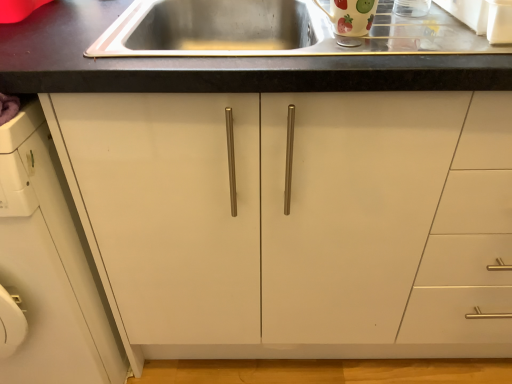
Question: Is glossy ceramic mug at upper center next to white matte cabinet at left?

Choices:
 (A) no
 (B) yes

Answer: (A)

Question: Is glossy ceramic mug at upper center positioned before white matte cabinet at left?

Choices:
 (A) yes
 (B) no

Answer: (B)

Question: Considering the relative positions of glossy ceramic mug at upper center and white matte cabinet at left in the image provided, is glossy ceramic mug at upper center to the right of white matte cabinet at left from the viewer's perspective?

Choices:
 (A) no
 (B) yes

Answer: (B)

Question: Is glossy ceramic mug at upper center not inside white matte cabinet at left?

Choices:
 (A) yes
 (B) no

Answer: (A)

Question: From a real-world perspective, is glossy ceramic mug at upper center beneath white matte cabinet at left?

Choices:
 (A) no
 (B) yes

Answer: (A)

Question: From a real-world perspective, does glossy ceramic mug at upper center stand above white matte cabinet at left?

Choices:
 (A) no
 (B) yes

Answer: (B)

Question: Is white matte cabinet at left touching glossy ceramic mug at upper center?

Choices:
 (A) yes
 (B) no

Answer: (B)

Question: Can you confirm if white matte cabinet at left is positioned to the right of glossy ceramic mug at upper center?

Choices:
 (A) no
 (B) yes

Answer: (A)

Question: Is white matte cabinet at left oriented away from glossy ceramic mug at upper center?

Choices:
 (A) no
 (B) yes

Answer: (A)

Question: Considering the relative sizes of white matte cabinet at left and glossy ceramic mug at upper center in the image provided, is white matte cabinet at left smaller than glossy ceramic mug at upper center?

Choices:
 (A) yes
 (B) no

Answer: (B)

Question: Does white matte cabinet at left contain glossy ceramic mug at upper center?

Choices:
 (A) yes
 (B) no

Answer: (B)

Question: From the image's perspective, is white matte cabinet at left above glossy ceramic mug at upper center?

Choices:
 (A) no
 (B) yes

Answer: (A)

Question: Visually, is white matte cabinet at left positioned to the left or to the right of glossy ceramic mug at upper center?

Choices:
 (A) left
 (B) right

Answer: (A)